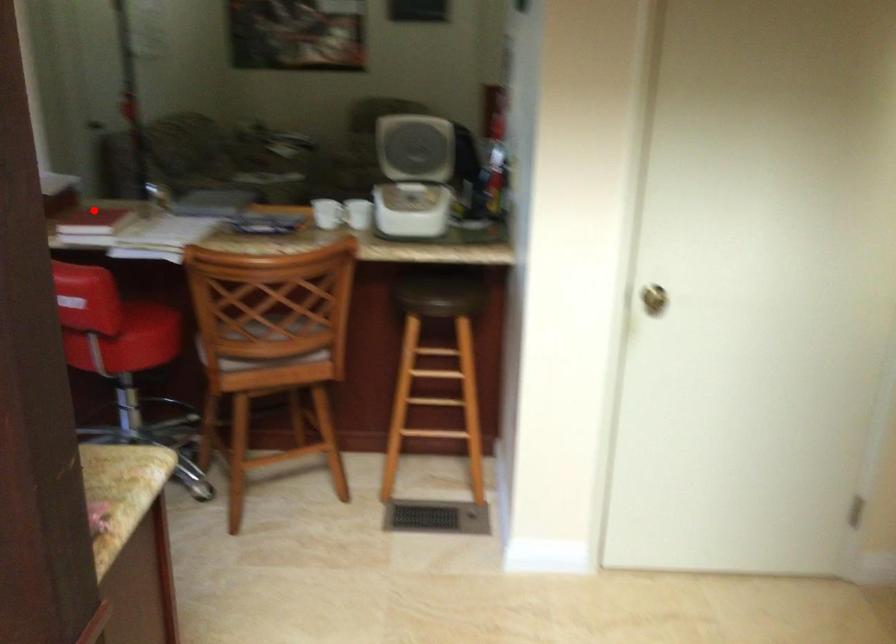
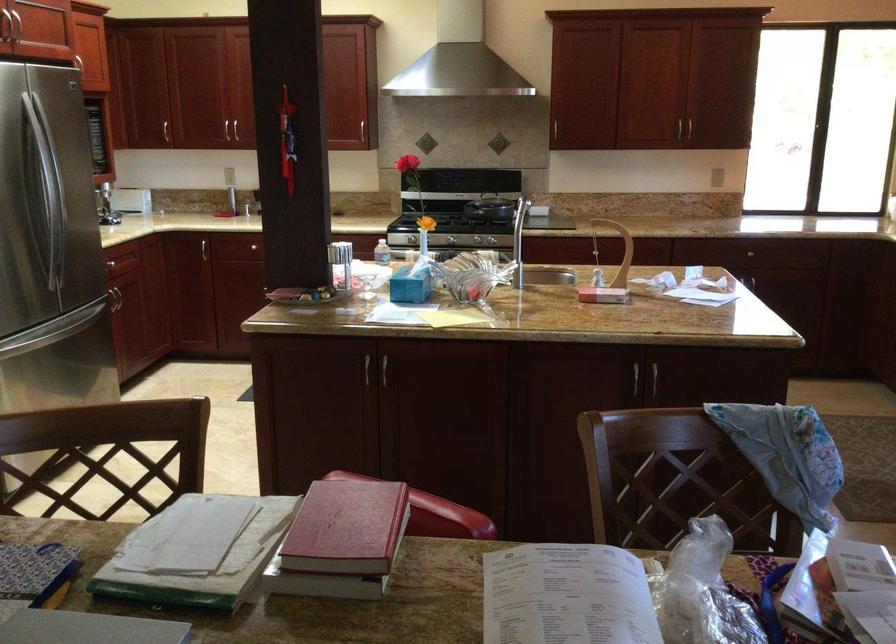
Question: I am providing you with two images of the same scene from different viewpoints. Given a red point in image1, look at the same physical point in image2. Is it:

Choices:
 (A) Closer to the viewpoint
 (B) Farther from the viewpoint

Answer: (A)